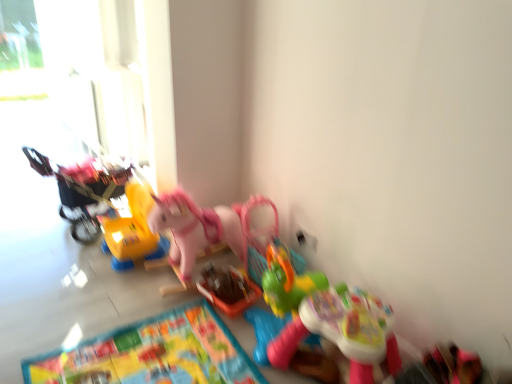
Find the location of `vacant space in multicolored fabric mat at lower center (from a real-world perspective)`. vacant space in multicolored fabric mat at lower center (from a real-world perspective) is located at coordinates 143,358.